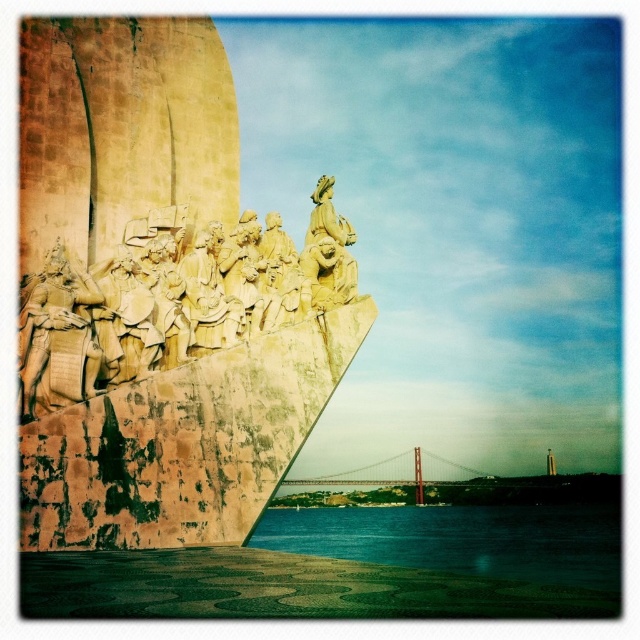
Question: Which object appears closest to the camera in this image?

Choices:
 (A) blue water at lower center
 (B) golden stone monument at left
 (C) golden metallic suspension bridge at center

Answer: (B)

Question: Does yellow stone sculpture at upper left have a larger size compared to blue water at lower center?

Choices:
 (A) yes
 (B) no

Answer: (B)

Question: Does blue water at lower center appear on the left side of golden metallic suspension bridge at center?

Choices:
 (A) yes
 (B) no

Answer: (B)

Question: Which of the following is the closest to the observer?

Choices:
 (A) (276, 324)
 (B) (410, 532)
 (C) (104, 202)
 (D) (381, 460)

Answer: (C)

Question: Which object appears closest to the camera in this image?

Choices:
 (A) golden metallic suspension bridge at center
 (B) golden stone monument at left
 (C) yellow stone sculpture at upper left

Answer: (B)

Question: Is golden stone monument at left thinner than blue water at lower center?

Choices:
 (A) yes
 (B) no

Answer: (A)